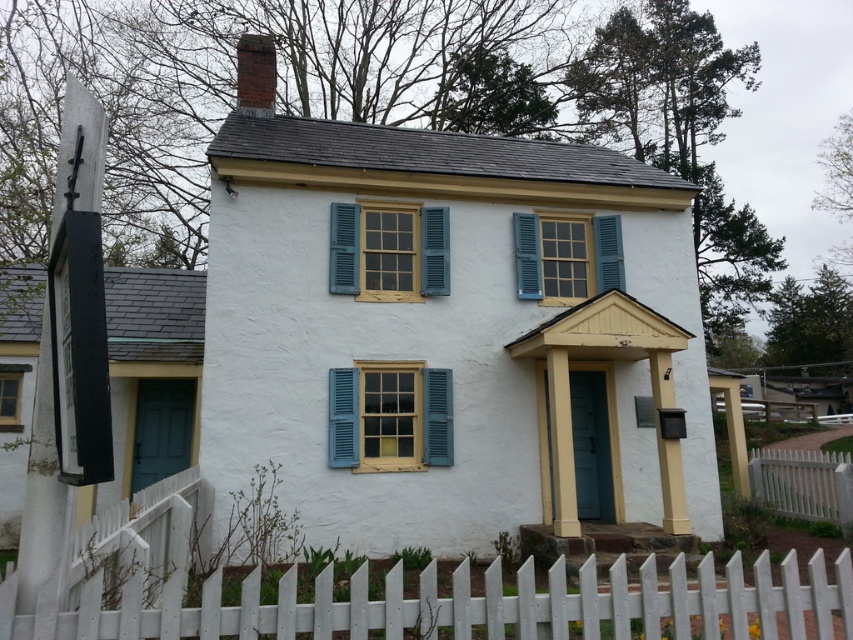
You are standing in front of the house and want to enter through the light blue door. To do so, you need to walk between the white picket fence at lower center and the yellow wood window at center. Which direction should you walk to reach the door?

You should walk towards the yellow wood window at center because the white picket fence at lower center is below it, meaning the fence is closer to the ground and the window is higher up, so the path to the door is between them.

In the scene shown: You are a painter hired to paint the white picket fence at lower center and the yellow wood window at center. You have a limited amount of paint. Which object requires more paint because of its size?

The white picket fence at lower center requires more paint because it has a larger size compared to the yellow wood window at center.

You are a painter who needs to assess the height of the matte blue shutters at center and the white picket fence at lower right. Which one is taller?

The matte blue shutters at center is taller than the white picket fence at lower right according to the description.